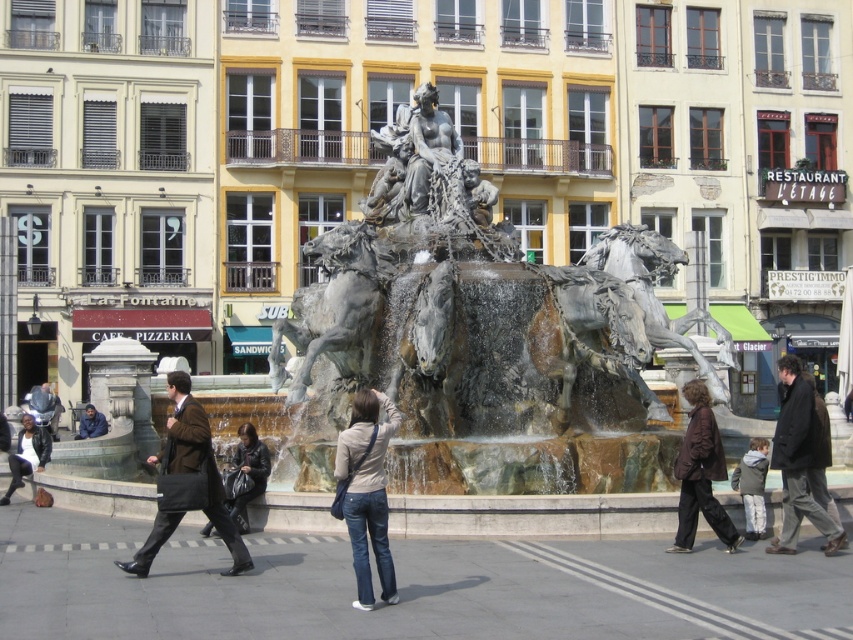
Question: Which point is farther to the camera?

Choices:
 (A) matte black jacket at lower left
 (B) denim jeans at center
 (C) brown leather jacket at lower right
 (D) polished bronze horse at center

Answer: (D)

Question: Which of the following is the closest to the observer?

Choices:
 (A) (767, 552)
 (B) (383, 572)
 (C) (387, 264)

Answer: (B)

Question: From the image, what is the correct spatial relationship of polished silver horse at center in relation to dark blue jacket at lower left?

Choices:
 (A) above
 (B) below

Answer: (A)

Question: Which point is closer to the camera taking this photo?

Choices:
 (A) (22, 442)
 (B) (38, 406)

Answer: (A)

Question: Considering the relative positions of brown leather coat at center and dark brown coat at lower right in the image provided, where is brown leather coat at center located with respect to dark brown coat at lower right?

Choices:
 (A) left
 (B) right

Answer: (A)

Question: Does denim jeans at center have a smaller size compared to dark brown coat at lower right?

Choices:
 (A) no
 (B) yes

Answer: (B)